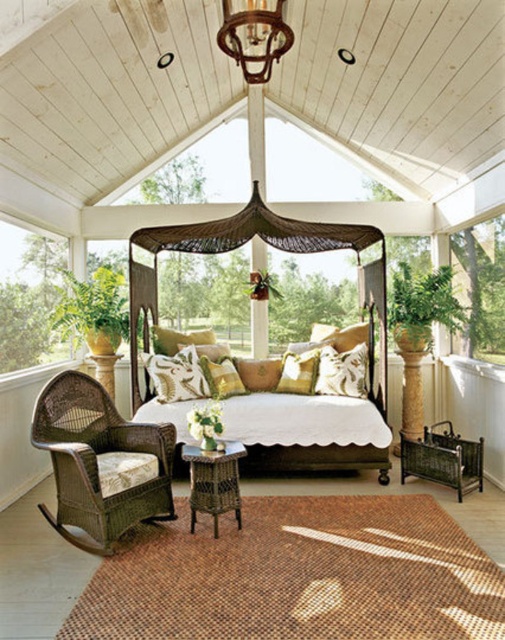
Question: Is transparent glass window at left to the right of rustic wood chandelier at upper center from the viewer's perspective?

Choices:
 (A) no
 (B) yes

Answer: (A)

Question: Which of the following is the farthest from the observer?

Choices:
 (A) rattan canopy bed at center
 (B) rustic wood chandelier at upper center

Answer: (A)

Question: Among these points, which one is nearest to the camera?

Choices:
 (A) (113, 490)
 (B) (315, 232)
 (C) (244, 44)

Answer: (A)

Question: Does woven wicker rocking chair at lower left have a greater width compared to transparent glass window at left?

Choices:
 (A) no
 (B) yes

Answer: (B)

Question: Which point is farther to the camera?

Choices:
 (A) rustic wood chandelier at upper center
 (B) transparent glass window at upper right
 (C) white cotton pillow at center
 (D) transparent glass window at left

Answer: (C)

Question: Is rattan canopy bed at center in front of transparent glass window at left?

Choices:
 (A) yes
 (B) no

Answer: (B)